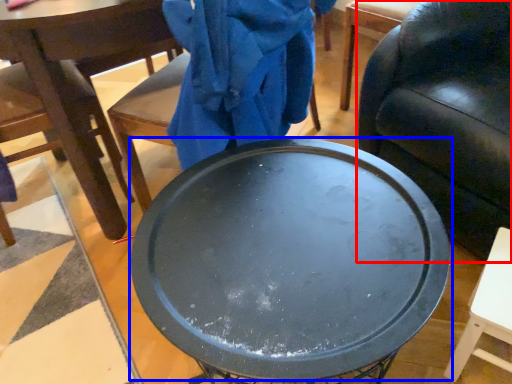
Question: Which of the following is the farthest to the observer, chair (highlighted by a red box) or round table (highlighted by a blue box)?

Choices:
 (A) chair
 (B) round table

Answer: (A)